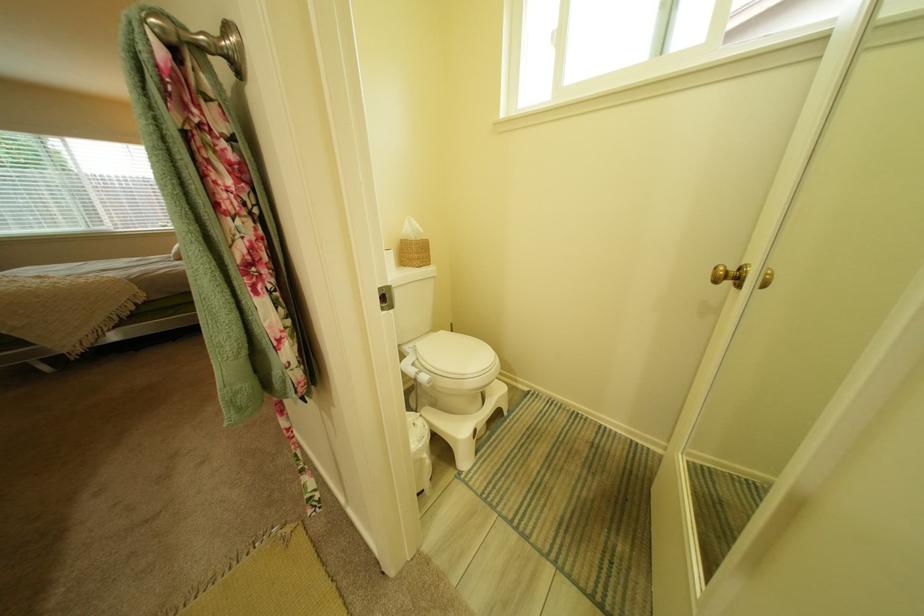
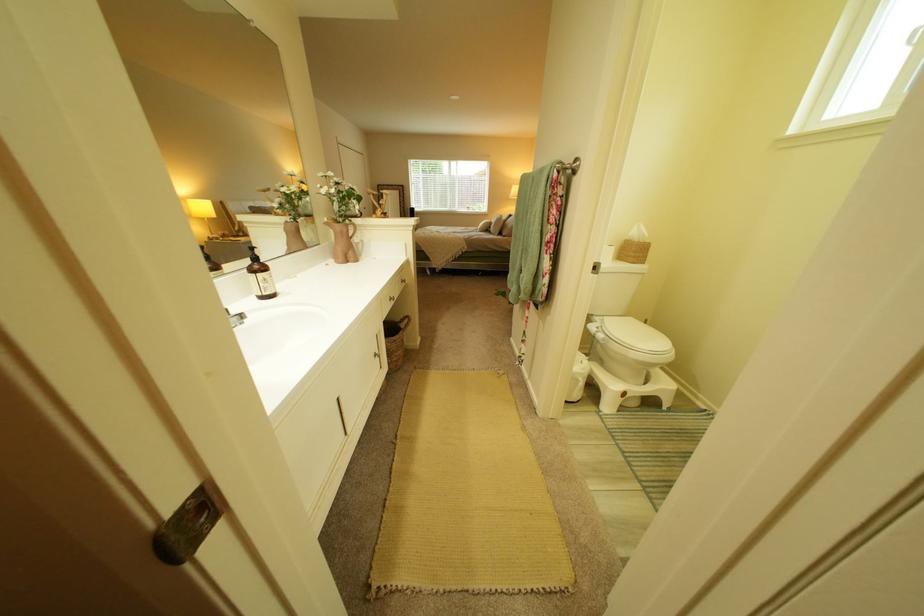
The point at (190,257) is marked in the first image. Where is the corresponding point in the second image?

(495, 230)